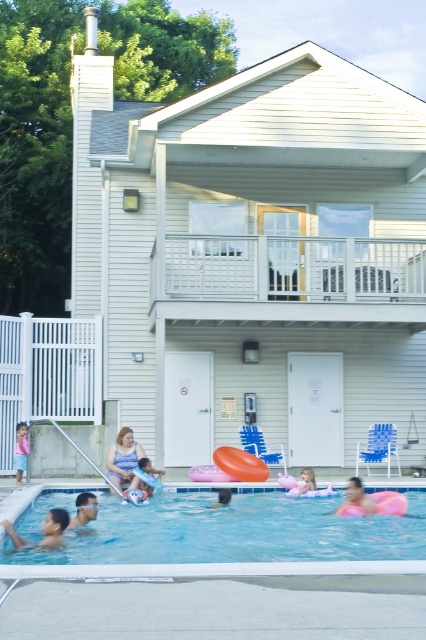
Question: Where is blue denim shorts at lower left located in relation to matte pink float at center in the image?

Choices:
 (A) left
 (B) right

Answer: (A)

Question: In this image, where is smooth skin face at lower left located relative to light blue denim shorts at lower left?

Choices:
 (A) left
 (B) right

Answer: (B)

Question: Which is nearer to the smooth skin face at lower left?

Choices:
 (A) matte pink float at center
 (B) pink rubber ring at center
 (C) blue denim shorts at lower left

Answer: (B)

Question: Which object is farther from the camera taking this photo?

Choices:
 (A) matte pink float at center
 (B) pink rubber ring at lower center
 (C) smooth pink float at center
 (D) pink rubber ring at center

Answer: (C)

Question: Among these points, which one is nearest to the camera?

Choices:
 (A) (227, 497)
 (B) (63, 538)
 (C) (141, 477)
 (D) (120, 531)

Answer: (B)

Question: Can you confirm if smooth skin boy at lower left is smaller than smooth pink float at center?

Choices:
 (A) no
 (B) yes

Answer: (A)